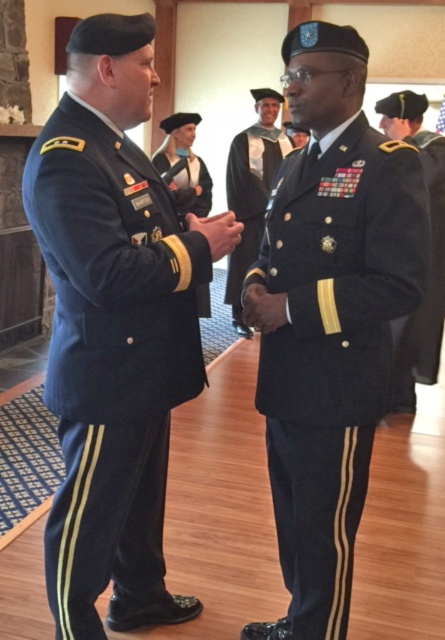
Is navy blue fabric uniform at center below shiny black uniform at center?

Correct, navy blue fabric uniform at center is located below shiny black uniform at center.

Locate an element on the screen. navy blue fabric uniform at center is located at coordinates (331, 349).

Where is `navy blue fabric uniform at center`? The image size is (445, 640). navy blue fabric uniform at center is located at coordinates (331, 349).

Does navy blue fabric uniform at center have a smaller size compared to matte black uniform at center?

No, navy blue fabric uniform at center is not smaller than matte black uniform at center.

Who is more distant from viewer, (376,394) or (201,172)?

The point (201,172) is behind.

Between point (356, 480) and point (194, 166), which one is positioned behind?

Point (194, 166)

Where is `navy blue fabric uniform at center`? This screenshot has height=640, width=445. navy blue fabric uniform at center is located at coordinates (331, 349).

Does navy blue fabric uniform at left appear over navy blue fabric uniform at center?

Correct, navy blue fabric uniform at left is located above navy blue fabric uniform at center.

Is navy blue fabric uniform at left wider than navy blue fabric uniform at center?

Correct, the width of navy blue fabric uniform at left exceeds that of navy blue fabric uniform at center.

Locate an element on the screen. navy blue fabric uniform at left is located at coordinates (110, 356).